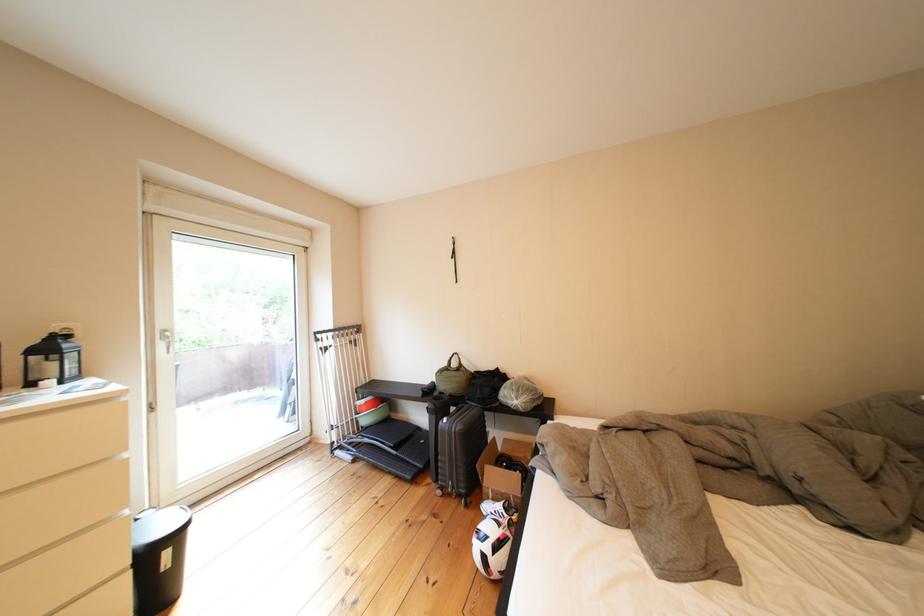
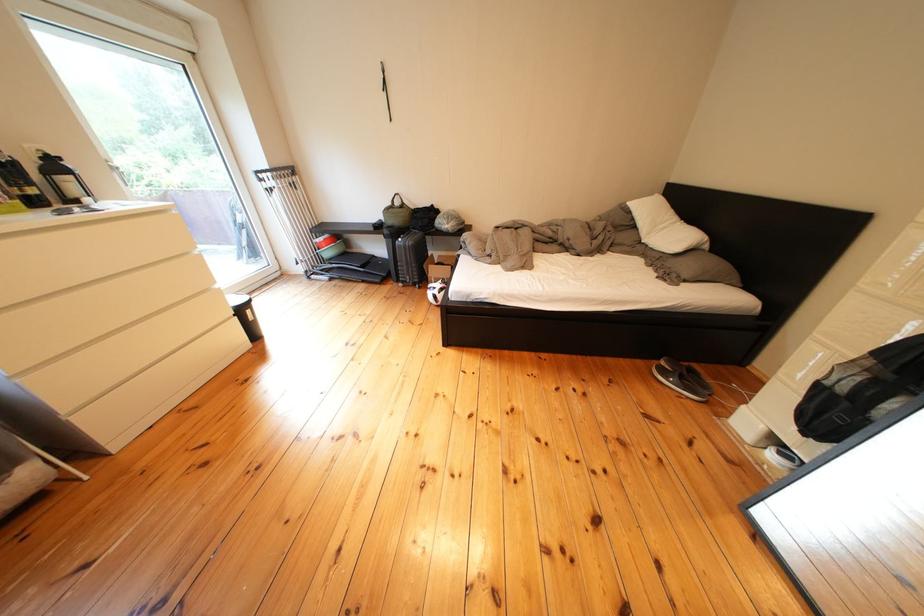
Locate, in the second image, the point that corresponds to point 113,528 in the first image.

(220, 294)